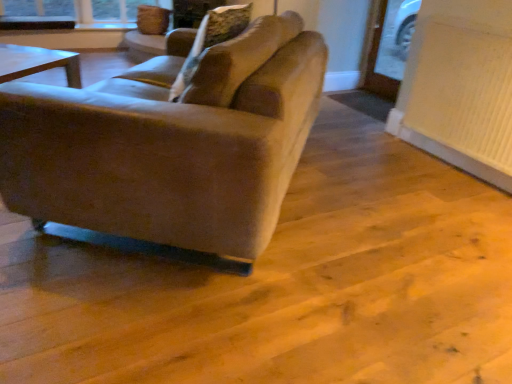
Measure the distance between point (252, 52) and camera.

The distance of point (252, 52) from camera is 4.69 feet.

The height and width of the screenshot is (384, 512). What do you see at coordinates (169, 149) in the screenshot?
I see `suede-like beige couch at center` at bounding box center [169, 149].

Locate an element on the screen. This screenshot has width=512, height=384. suede-like beige pillow at center is located at coordinates click(x=210, y=40).

Can you confirm if white textured radiator at lower right is shorter than suede-like beige pillow at center?

No, white textured radiator at lower right is not shorter than suede-like beige pillow at center.

Considering the relative positions of white textured radiator at lower right and suede-like beige pillow at center in the image provided, is white textured radiator at lower right behind suede-like beige pillow at center?

Yes, white textured radiator at lower right is behind suede-like beige pillow at center.

Does white textured radiator at lower right appear on the left side of suede-like beige pillow at center?

→ No.

Is point (500, 70) in front of point (212, 39)?

No, (500, 70) is behind (212, 39).

Considering the positions of point (210, 180) and point (214, 17), is point (210, 180) closer or farther from the camera than point (214, 17)?

Point (210, 180).

Does suede-like beige couch at center have a smaller size compared to suede-like beige pillow at center?

Actually, suede-like beige couch at center might be larger than suede-like beige pillow at center.

Is suede-like beige couch at center placed right next to suede-like beige pillow at center?

There is a gap between suede-like beige couch at center and suede-like beige pillow at center.

Can you confirm if suede-like beige couch at center is wider than white textured radiator at lower right?

Yes.

From the image's perspective, which object appears higher, suede-like beige couch at center or white textured radiator at lower right?

white textured radiator at lower right is shown above in the image.

Which is more to the left, suede-like beige couch at center or white textured radiator at lower right?

suede-like beige couch at center is more to the left.

Which of these two, suede-like beige couch at center or white textured radiator at lower right, is bigger?

With larger size is suede-like beige couch at center.

Is suede-like beige pillow at center spatially inside white textured radiator at lower right, or outside of it?

suede-like beige pillow at center is not inside white textured radiator at lower right, it's outside.

From a real-world perspective, does suede-like beige pillow at center sit lower than white textured radiator at lower right?

Incorrect, from a real-world perspective, suede-like beige pillow at center is higher than white textured radiator at lower right.

Which is more to the left, suede-like beige pillow at center or white textured radiator at lower right?

Positioned to the left is suede-like beige pillow at center.

Considering the relative sizes of suede-like beige pillow at center and white textured radiator at lower right in the image provided, is suede-like beige pillow at center thinner than white textured radiator at lower right?

No.

Is suede-like beige pillow at center facing towards suede-like beige couch at center?

Yes, suede-like beige pillow at center is facing suede-like beige couch at center.

Is suede-like beige pillow at center thinner than suede-like beige couch at center?

Yes, suede-like beige pillow at center is thinner than suede-like beige couch at center.

Does point (242, 10) lie behind point (253, 148)?

Yes, point (242, 10) is farther from viewer.

Does white textured radiator at lower right contain suede-like beige couch at center?

No, suede-like beige couch at center is not a part of white textured radiator at lower right.

Considering the points (463, 112) and (291, 147), which point is in front, point (463, 112) or point (291, 147)?

Point (291, 147)

Which object is further away from the camera taking this photo, white textured radiator at lower right or suede-like beige couch at center?

white textured radiator at lower right is further from the camera.

At what (x,y) coordinates should I click in order to perform the action: click on pillow above the white textured radiator at lower right (from a real-world perspective). Please return your answer as a coordinate pair (x, y). This screenshot has height=384, width=512. Looking at the image, I should click on (210, 40).

Locate an element on the screen. The height and width of the screenshot is (384, 512). studio couch on the left of suede-like beige pillow at center is located at coordinates (169, 149).

Based on the photo, considering their positions, is white textured radiator at lower right positioned closer to suede-like beige pillow at center than suede-like beige couch at center?

suede-like beige couch at center lies closer to suede-like beige pillow at center than the other object.

Based on their spatial positions, is white textured radiator at lower right or suede-like beige pillow at center closer to suede-like beige couch at center?

suede-like beige pillow at center is closer to suede-like beige couch at center.

Estimate the real-world distances between objects in this image. Which object is further from suede-like beige pillow at center, suede-like beige couch at center or white textured radiator at lower right?

Based on the image, white textured radiator at lower right appears to be further to suede-like beige pillow at center.

Looking at the image, which one is located further to suede-like beige couch at center, suede-like beige pillow at center or white textured radiator at lower right?

white textured radiator at lower right is positioned further to the anchor suede-like beige couch at center.

Based on their spatial positions, is suede-like beige pillow at center or suede-like beige couch at center further from white textured radiator at lower right?

The object further to white textured radiator at lower right is suede-like beige pillow at center.

Which object lies further to the anchor point white textured radiator at lower right, suede-like beige couch at center or suede-like beige pillow at center?

The object further to white textured radiator at lower right is suede-like beige pillow at center.

Locate an element on the screen. This screenshot has height=384, width=512. pillow located between suede-like beige couch at center and white textured radiator at lower right in the left-right direction is located at coordinates pos(210,40).